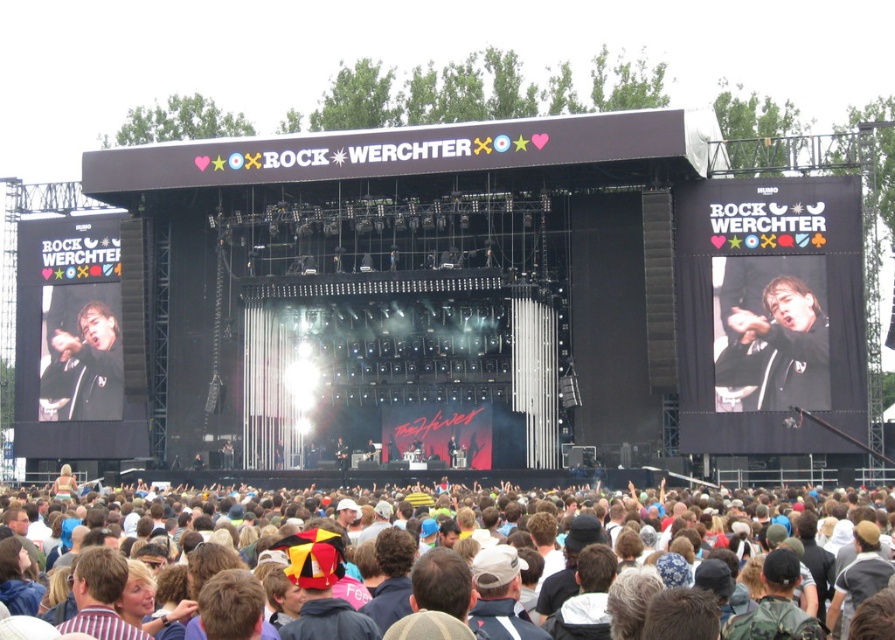
Question: Which point appears closest to the camera in this image?

Choices:
 (A) (800, 369)
 (B) (124, 628)

Answer: (B)

Question: Does black matte jacket at upper right have a lesser width compared to matte black jacket at center?

Choices:
 (A) no
 (B) yes

Answer: (B)

Question: Which of the following is the farthest from the observer?

Choices:
 (A) dark brown hair at lower center
 (B) matte black jacket at center
 (C) black matte jacket at upper right

Answer: (B)

Question: Does dark brown hair at lower center appear on the right side of black matte jacket at upper right?

Choices:
 (A) yes
 (B) no

Answer: (B)

Question: Which object is positioned farthest from the black matte jacket at upper right?

Choices:
 (A) dark brown hair at lower center
 (B) matte black jacket at center

Answer: (B)

Question: Is dark brown hair at lower center above black matte jacket at upper right?

Choices:
 (A) no
 (B) yes

Answer: (A)